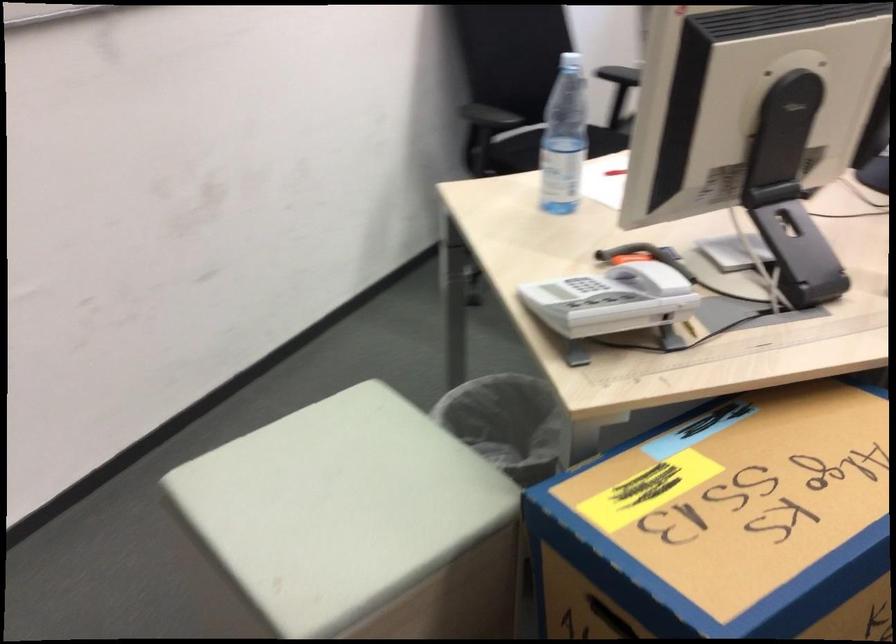
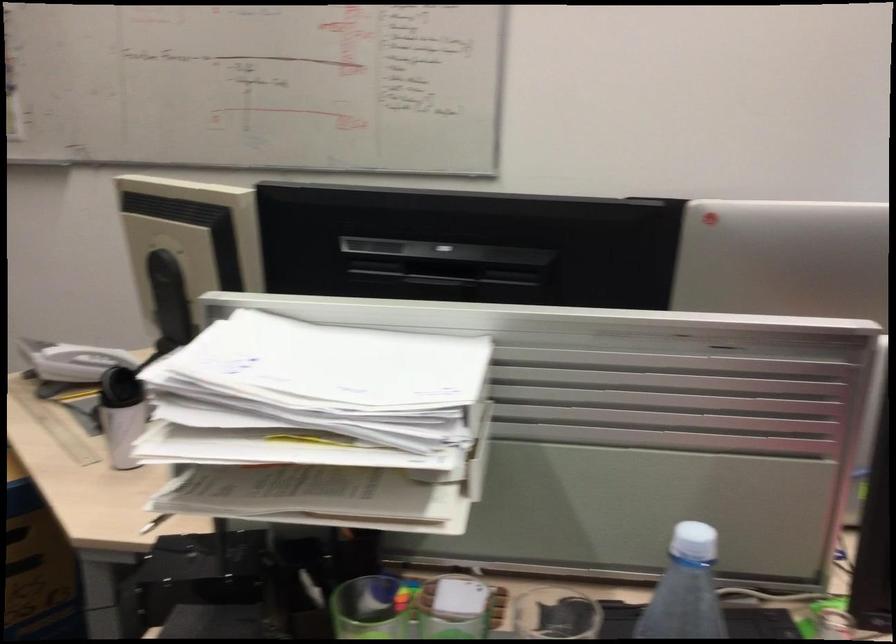
Question: I am providing you with two images of the same scene from different viewpoints. Which of the following objects are not visible in image2?

Choices:
 (A) green pen holder
 (B) pikachu plush toy
 (C) white bottle cap
 (D) white telephone handset

Answer: (D)